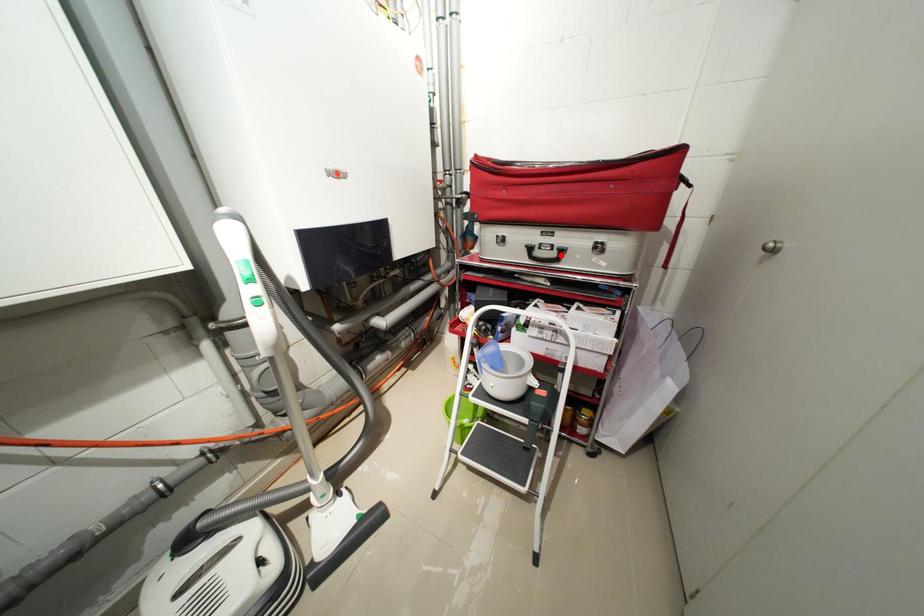
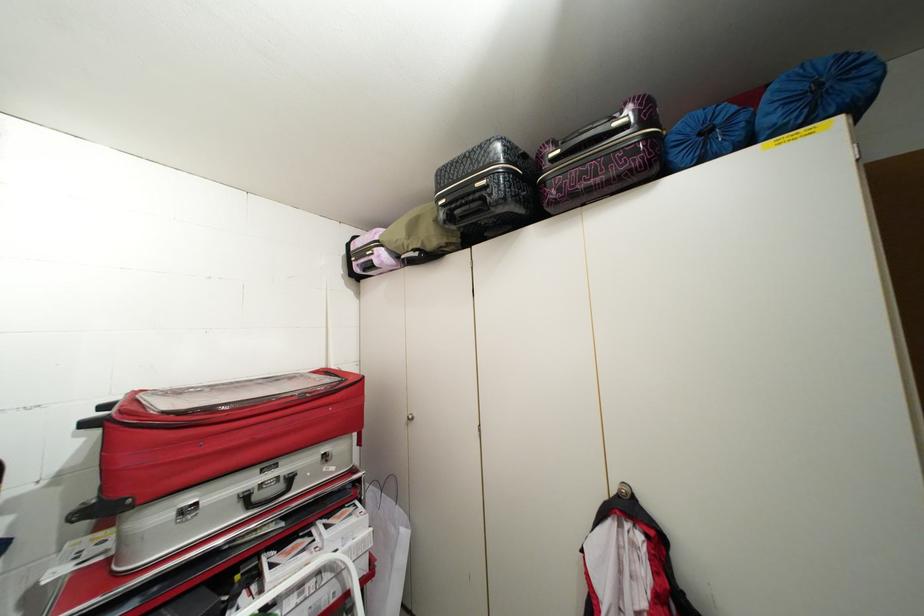
Question: I am providing you with two images of the same scene from different viewpoints. Given a red point in image1, look at the same physical point in image2. Is it:

Choices:
 (A) Closer to the viewpoint
 (B) Farther from the viewpoint

Answer: (B)